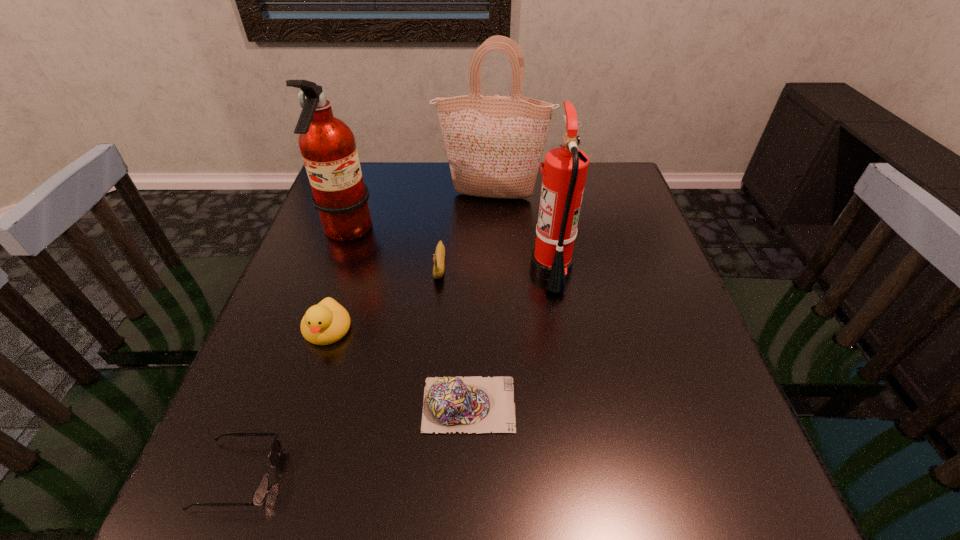
Identify the location of vacant space situated on the nozzle and handle of the left fire extinguisher. The image size is (960, 540). (463, 233).

At what (x,y) coordinates should I click in order to perform the action: click on free region located 0.400m at the nozzle of the right fire extinguisher. Please return your answer as a coordinate pair (x, y). Looking at the image, I should click on (360, 269).

Find the location of a particular element. The width and height of the screenshot is (960, 540). free space located 0.190m at the nozzle of the right fire extinguisher is located at coordinates (449, 269).

Identify the location of free location located at the nozzle of the right fire extinguisher. pos(395,269).

At what (x,y) coordinates should I click in order to perform the action: click on free region located 0.330m at the stem of the banana. Please return your answer as a coordinate pair (x, y). Looking at the image, I should click on (424, 421).

You are a GUI agent. You are given a task and a screenshot of the screen. Output one action in this format:
    pyautogui.click(x=<x>, y=<y>)
    Task: Click on the free location located on the face of the duckling
    This screenshot has width=960, height=540.
    Given the screenshot: What is the action you would take?
    pyautogui.click(x=308, y=390)

Find the location of a particular element. Image resolution: width=960 pixels, height=540 pixels. free space located 0.350m on the front, side, and top of the second shortest object is located at coordinates (712, 404).

Identify the location of vacant area situated 0.280m at the front lenses of the sunglasses. (453, 476).

Find the location of a particular element. object positioned at the far edge is located at coordinates (494, 144).

The height and width of the screenshot is (540, 960). Identify the location of object at the near edge. click(262, 489).